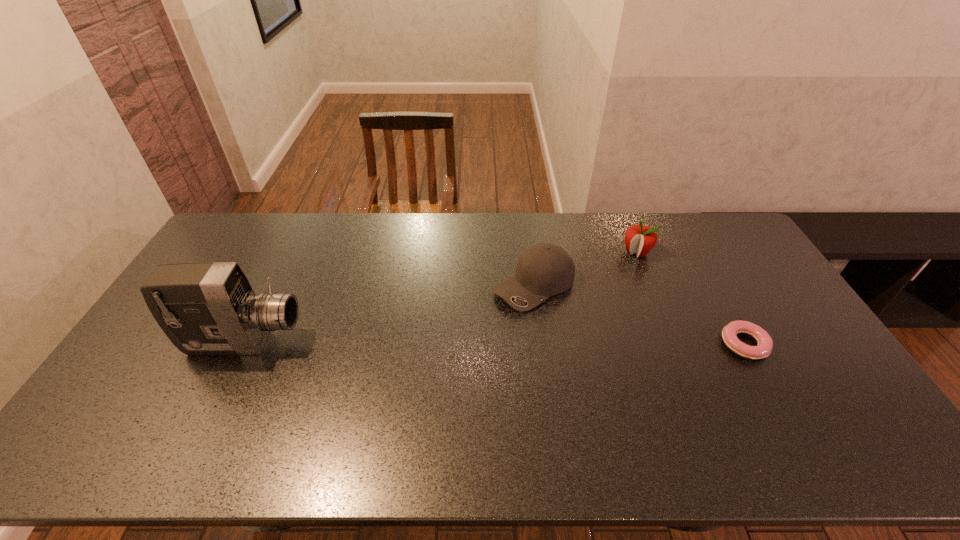
Locate an element on the screen. This screenshot has width=960, height=540. vacant space on the desktop that is between the tallest object and the doughnut and is positioned on the side where a bite is taken out of the apple is located at coordinates (557, 343).

You are a GUI agent. You are given a task and a screenshot of the screen. Output one action in this format:
    pyautogui.click(x=<x>, y=<y>)
    Task: Click on the vacant space on the desktop that is between the tallest object and the doughnut and is positioned on the front brim of the second object from left to right
    
    Given the screenshot: What is the action you would take?
    pyautogui.click(x=453, y=343)